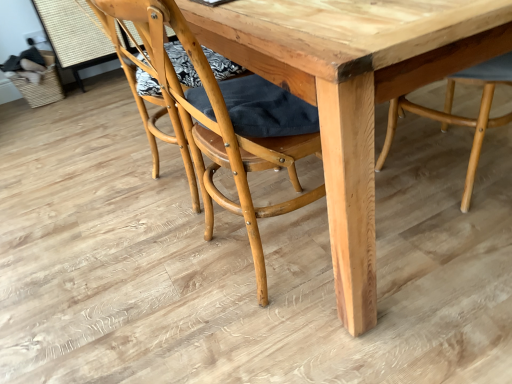
Identify the location of vacant area in front of natural wood chair at center, the first chair when ordered from left to right. This screenshot has height=384, width=512. (316, 340).